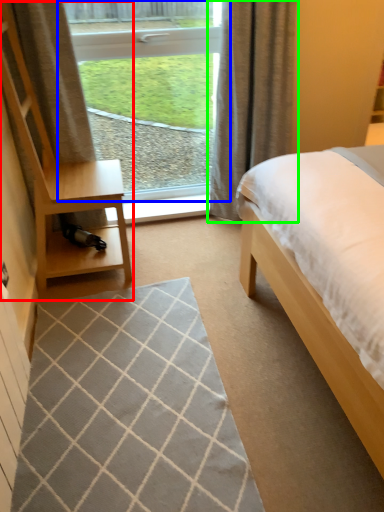
Question: Which is farther away from dresser (highlighted by a red box)? window (highlighted by a blue box) or curtain (highlighted by a green box)?

Choices:
 (A) window
 (B) curtain

Answer: (A)